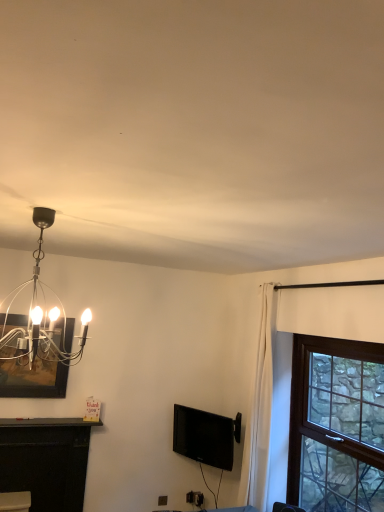
Question: From a real-world perspective, is black matte fireplace at lower left over polished silver chandelier at upper left?

Choices:
 (A) yes
 (B) no

Answer: (B)

Question: Is polished silver chandelier at upper left surrounded by black matte fireplace at lower left?

Choices:
 (A) yes
 (B) no

Answer: (B)

Question: Does black matte fireplace at lower left have a smaller size compared to polished silver chandelier at upper left?

Choices:
 (A) no
 (B) yes

Answer: (B)

Question: From a real-world perspective, is black matte fireplace at lower left below polished silver chandelier at upper left?

Choices:
 (A) no
 (B) yes

Answer: (B)

Question: Is black matte fireplace at lower left facing towards polished silver chandelier at upper left?

Choices:
 (A) yes
 (B) no

Answer: (B)

Question: Is black matte fireplace at lower left taller than polished silver chandelier at upper left?

Choices:
 (A) no
 (B) yes

Answer: (B)

Question: Does black matte fireplace at lower left have a greater height compared to brown wooden window at right?

Choices:
 (A) no
 (B) yes

Answer: (A)

Question: From a real-world perspective, is black matte fireplace at lower left located higher than brown wooden window at right?

Choices:
 (A) no
 (B) yes

Answer: (A)

Question: Is black matte fireplace at lower left to the right of brown wooden window at right from the viewer's perspective?

Choices:
 (A) yes
 (B) no

Answer: (B)

Question: Is black matte fireplace at lower left positioned far away from brown wooden window at right?

Choices:
 (A) no
 (B) yes

Answer: (B)

Question: Is black matte fireplace at lower left not inside brown wooden window at right?

Choices:
 (A) yes
 (B) no

Answer: (A)

Question: Is black matte fireplace at lower left oriented towards brown wooden window at right?

Choices:
 (A) no
 (B) yes

Answer: (A)

Question: Is black glossy tv at center thinner than brown wooden window at right?

Choices:
 (A) yes
 (B) no

Answer: (A)